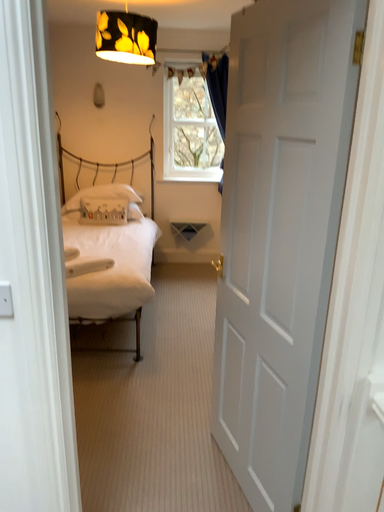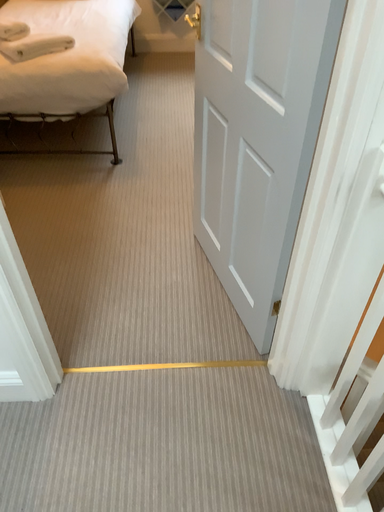
Question: Which way did the camera rotate in the video?

Choices:
 (A) rotated upward
 (B) rotated downward

Answer: (B)